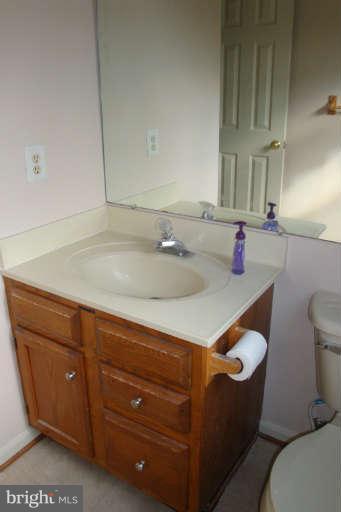
What are the coordinates of `toilet` in the screenshot? It's located at (304, 472).